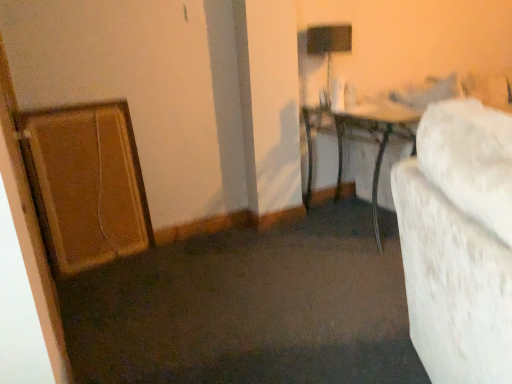
Question: Does black matte table lamp at upper center come behind metallic silver table at center?

Choices:
 (A) no
 (B) yes

Answer: (B)

Question: Is black matte table lamp at upper center closer to the viewer compared to metallic silver table at center?

Choices:
 (A) yes
 (B) no

Answer: (B)

Question: From a real-world perspective, does black matte table lamp at upper center sit lower than metallic silver table at center?

Choices:
 (A) yes
 (B) no

Answer: (B)

Question: Is black matte table lamp at upper center outside of metallic silver table at center?

Choices:
 (A) no
 (B) yes

Answer: (B)

Question: From the image's perspective, is black matte table lamp at upper center located above metallic silver table at center?

Choices:
 (A) yes
 (B) no

Answer: (A)

Question: Does black matte table lamp at upper center have a greater height compared to metallic silver table at center?

Choices:
 (A) no
 (B) yes

Answer: (A)

Question: Can you confirm if metallic silver table at center is shorter than black matte table lamp at upper center?

Choices:
 (A) yes
 (B) no

Answer: (B)

Question: Is metallic silver table at center wider than black matte table lamp at upper center?

Choices:
 (A) yes
 (B) no

Answer: (A)

Question: Considering the relative positions of metallic silver table at center and black matte table lamp at upper center in the image provided, is metallic silver table at center to the left of black matte table lamp at upper center from the viewer's perspective?

Choices:
 (A) no
 (B) yes

Answer: (A)

Question: From the image's perspective, does metallic silver table at center appear lower than black matte table lamp at upper center?

Choices:
 (A) no
 (B) yes

Answer: (B)

Question: Is metallic silver table at center facing towards black matte table lamp at upper center?

Choices:
 (A) yes
 (B) no

Answer: (B)

Question: Does metallic silver table at center appear on the right side of black matte table lamp at upper center?

Choices:
 (A) yes
 (B) no

Answer: (A)

Question: In terms of width, does metallic silver table at center look wider or thinner when compared to black matte table lamp at upper center?

Choices:
 (A) thin
 (B) wide

Answer: (B)